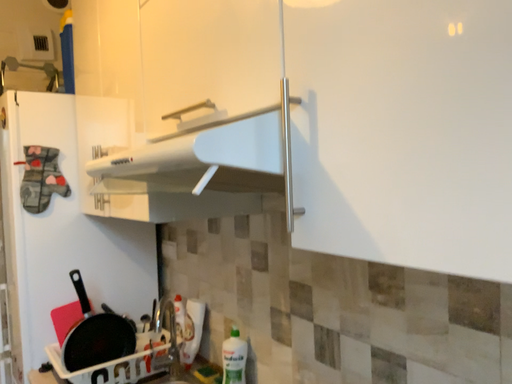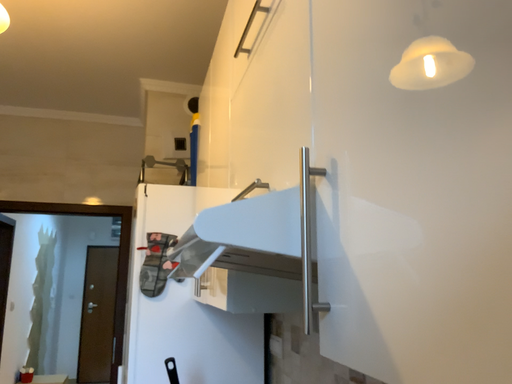
Question: How did the camera likely rotate when shooting the video?

Choices:
 (A) rotated downward
 (B) rotated upward

Answer: (B)